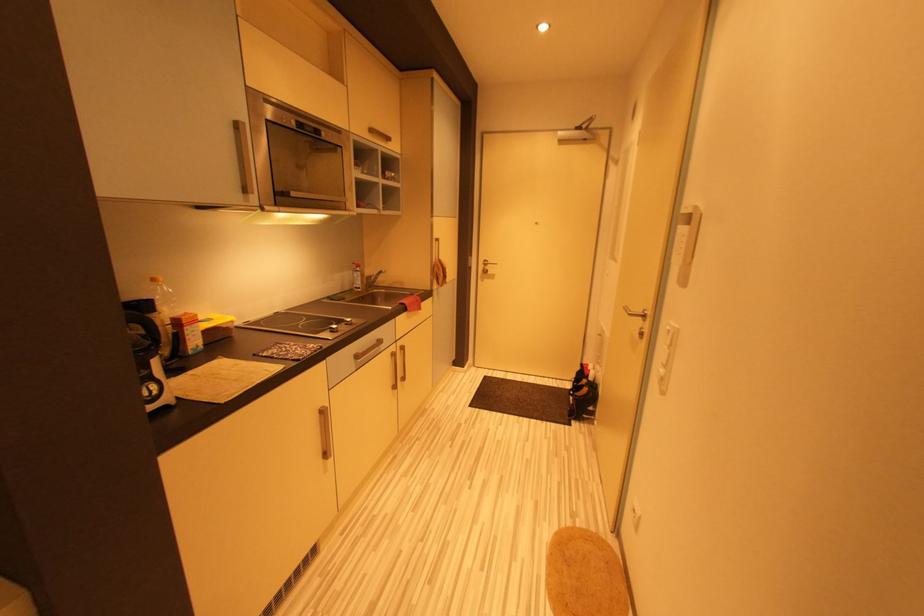
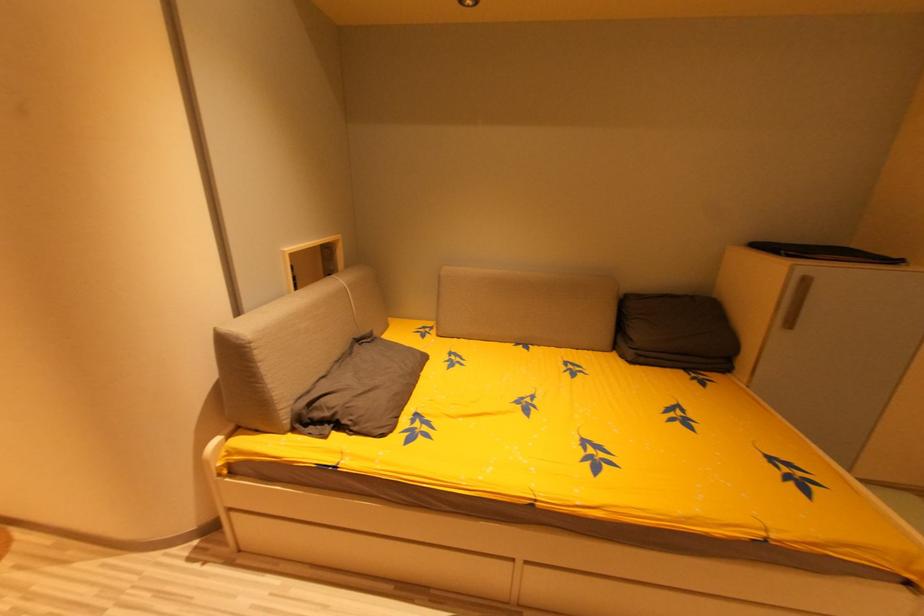
How did the camera likely rotate?

The rotation direction of the camera is right-down.